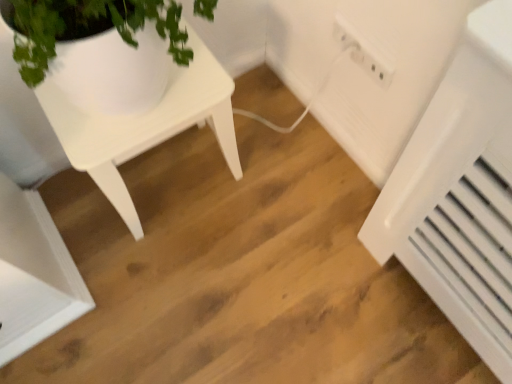
Measure the distance between white plastic electric outlet at upper right and camera.

white plastic electric outlet at upper right and camera are 3.31 feet apart from each other.

The height and width of the screenshot is (384, 512). Describe the element at coordinates (460, 192) in the screenshot. I see `white plastic radiator at lower right` at that location.

What do you see at coordinates (145, 126) in the screenshot?
I see `white matte table at upper left` at bounding box center [145, 126].

Locate an element on the screen. Image resolution: width=512 pixels, height=384 pixels. white plastic electric outlet at upper right is located at coordinates (364, 52).

Can you confirm if white plastic electric outlet at upper right is taller than white matte table at upper left?

Incorrect, the height of white plastic electric outlet at upper right is not larger of that of white matte table at upper left.

Between white plastic electric outlet at upper right and white matte table at upper left, which one has larger size?

white matte table at upper left is bigger.

Is white plastic electric outlet at upper right to the left of white matte table at upper left from the viewer's perspective?

No.

Considering the sizes of white plastic radiator at lower right and white plastic electric outlet at upper right in the image, is white plastic radiator at lower right wider or thinner than white plastic electric outlet at upper right?

white plastic radiator at lower right is wider than white plastic electric outlet at upper right.

Between white plastic radiator at lower right and white plastic electric outlet at upper right, which one is positioned behind?

white plastic radiator at lower right is more distant.

Considering the sizes of objects white plastic radiator at lower right and white plastic electric outlet at upper right in the image provided, who is smaller, white plastic radiator at lower right or white plastic electric outlet at upper right?

With smaller size is white plastic electric outlet at upper right.

Is white plastic radiator at lower right next to white plastic electric outlet at upper right and touching it?

white plastic radiator at lower right and white plastic electric outlet at upper right are clearly separated.

From the image's perspective, is white matte table at upper left positioned above or below white plastic electric outlet at upper right?

Based on their image positions, white matte table at upper left is located beneath white plastic electric outlet at upper right.

Can you tell me how much white matte table at upper left and white plastic electric outlet at upper right differ in facing direction?

There is a 88.7-degree angle between the facing directions of white matte table at upper left and white plastic electric outlet at upper right.

Do you think white matte table at upper left is within white plastic electric outlet at upper right, or outside of it?

white matte table at upper left is located beyond the bounds of white plastic electric outlet at upper right.

Is white matte table at upper left far from white plastic electric outlet at upper right?

That's not correct — white matte table at upper left is a little close to white plastic electric outlet at upper right.

From a real-world perspective, between white matte table at upper left and white plastic radiator at lower right, who is vertically lower?

white plastic radiator at lower right.

Between white matte table at upper left and white plastic radiator at lower right, which one has smaller width?

Thinner between the two is white plastic radiator at lower right.

From the image's perspective, is white matte table at upper left beneath white plastic radiator at lower right?

No, from the image's perspective, white matte table at upper left is not below white plastic radiator at lower right.

From the picture: Could white plastic radiator at lower right be considered to be inside white matte table at upper left?

That's incorrect, white plastic radiator at lower right is not inside white matte table at upper left.

Based on their positions, is white plastic electric outlet at upper right located to the left or right of white plastic radiator at lower right?

white plastic electric outlet at upper right is positioned on white plastic radiator at lower right's left side.

Between point (376, 50) and point (454, 169), which one is positioned in front?

The point (454, 169) is closer to the camera.

From a real-world perspective, is white plastic electric outlet at upper right on top of white plastic radiator at lower right?

Yes, from a real-world perspective, white plastic electric outlet at upper right is above white plastic radiator at lower right.

Is white plastic electric outlet at upper right looking in the opposite direction of white plastic radiator at lower right?

That's not correct — white plastic electric outlet at upper right is not looking away from white plastic radiator at lower right.

Which of these two, white plastic radiator at lower right or white matte table at upper left, is wider?

Wider between the two is white matte table at upper left.

Who is taller, white plastic radiator at lower right or white matte table at upper left?

white matte table at upper left is taller.

Is white plastic radiator at lower right in contact with white matte table at upper left?

They are not placed beside each other.

Find the location of a particular element. electric outlet above the white matte table at upper left (from a real-world perspective) is located at coordinates (364, 52).

At what (x,y) coordinates should I click in order to perform the action: click on electric outlet on the left of white plastic radiator at lower right. Please return your answer as a coordinate pair (x, y). Looking at the image, I should click on (364, 52).

From the image, which object appears to be nearer to white matte table at upper left, white plastic electric outlet at upper right or white plastic radiator at lower right?

The object closer to white matte table at upper left is white plastic electric outlet at upper right.

Consider the image. Based on their spatial positions, is white matte table at upper left or white plastic radiator at lower right further from white plastic electric outlet at upper right?

white matte table at upper left is further to white plastic electric outlet at upper right.

From the image, which object appears to be nearer to white matte table at upper left, white plastic radiator at lower right or white plastic electric outlet at upper right?

Based on the image, white plastic electric outlet at upper right appears to be nearer to white matte table at upper left.

Considering their positions, is white matte table at upper left positioned further to white plastic radiator at lower right than white plastic electric outlet at upper right?

white matte table at upper left is positioned further to the anchor white plastic radiator at lower right.

Which object lies further to the anchor point white plastic electric outlet at upper right, white plastic radiator at lower right or white matte table at upper left?

white matte table at upper left.

Which object lies further to the anchor point white plastic radiator at lower right, white plastic electric outlet at upper right or white matte table at upper left?

white matte table at upper left is positioned further to the anchor white plastic radiator at lower right.

Locate an element on the screen. The height and width of the screenshot is (384, 512). electric outlet located between white matte table at upper left and white plastic radiator at lower right in the left-right direction is located at coordinates (364, 52).